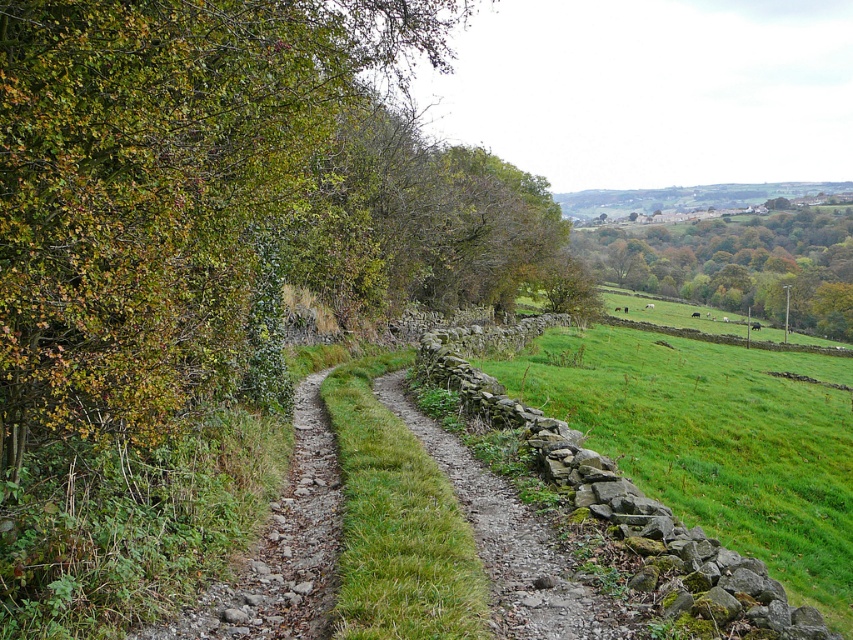
Question: Is green leafy tree at upper right further to the viewer compared to dull gray gravel path at left?

Choices:
 (A) yes
 (B) no

Answer: (A)

Question: From the image, what is the correct spatial relationship of green leafy tree at upper left in relation to dull gray gravel path at left?

Choices:
 (A) above
 (B) below

Answer: (A)

Question: Is green grassy field at right bigger than dusty gravel path at center?

Choices:
 (A) no
 (B) yes

Answer: (B)

Question: Which of these objects is positioned closest to the dusty gravel path at center?

Choices:
 (A) green leafy tree at upper right
 (B) green grassy field at right
 (C) dull gray gravel path at left
 (D) green leafy tree at upper left

Answer: (C)

Question: Which point is closer to the camera?

Choices:
 (A) dull gray gravel path at left
 (B) green leafy tree at upper left
 (C) dusty gravel path at center

Answer: (A)

Question: Based on their relative distances, which object is nearer to the dull gray gravel path at left?

Choices:
 (A) green grassy field at right
 (B) green leafy tree at upper right

Answer: (A)